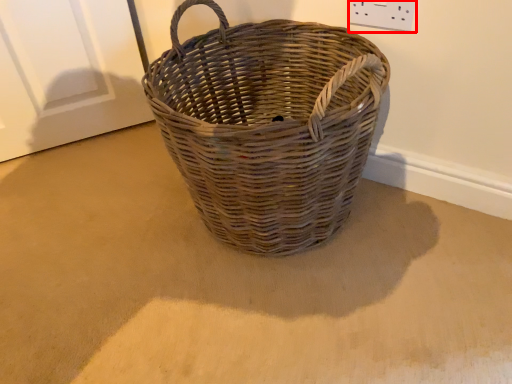
Question: From the image's perspective, what is the correct spatial positioning of electric outlet (annotated by the red box) in reference to picnic basket?

Choices:
 (A) below
 (B) above

Answer: (B)